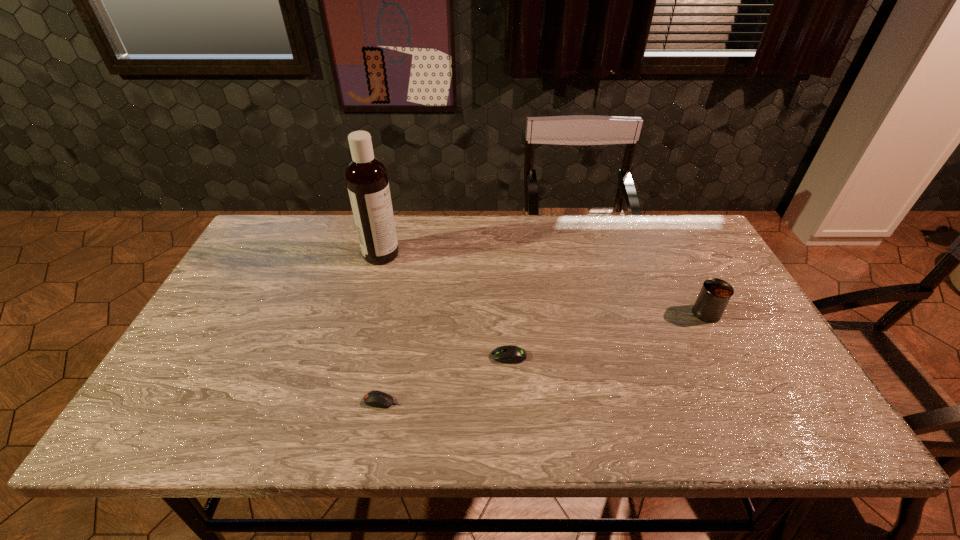
Image resolution: width=960 pixels, height=540 pixels. I want to click on vacant area between the nearer computer mouse and the rightmost object, so click(544, 357).

The width and height of the screenshot is (960, 540). I want to click on free space between the tallest object and the third shortest object, so click(543, 284).

What are the coordinates of `free space between the tallest object and the second nearest object` in the screenshot? It's located at (444, 305).

Image resolution: width=960 pixels, height=540 pixels. I want to click on object that is the second nearest to the nearer computer mouse, so click(366, 177).

Image resolution: width=960 pixels, height=540 pixels. I want to click on the closest object relative to the third shortest object, so click(x=509, y=354).

The width and height of the screenshot is (960, 540). What are the coordinates of `free space that satisfies the following two spatial constraints: 1. on the label side of the nearest object; 2. on the left side of the farthest object` in the screenshot? It's located at (343, 401).

Where is `vacant space that satisfies the following two spatial constraints: 1. on the label side of the farthest object; 2. on the back side of the rightmost object`? Image resolution: width=960 pixels, height=540 pixels. vacant space that satisfies the following two spatial constraints: 1. on the label side of the farthest object; 2. on the back side of the rightmost object is located at coordinates (366, 313).

This screenshot has height=540, width=960. Find the location of `vacant point that satisfies the following two spatial constraints: 1. on the label side of the dishwasher detergent; 2. on the left side of the third shortest object`. vacant point that satisfies the following two spatial constraints: 1. on the label side of the dishwasher detergent; 2. on the left side of the third shortest object is located at coordinates (366, 313).

The image size is (960, 540). Find the location of `vacant space that satisfies the following two spatial constraints: 1. on the label side of the dishwasher detergent; 2. on the right side of the rightmost object`. vacant space that satisfies the following two spatial constraints: 1. on the label side of the dishwasher detergent; 2. on the right side of the rightmost object is located at coordinates (366, 313).

The image size is (960, 540). What are the coordinates of `vacant point that satisfies the following two spatial constraints: 1. on the label side of the farthest object; 2. on the right side of the nearer computer mouse` in the screenshot? It's located at (343, 401).